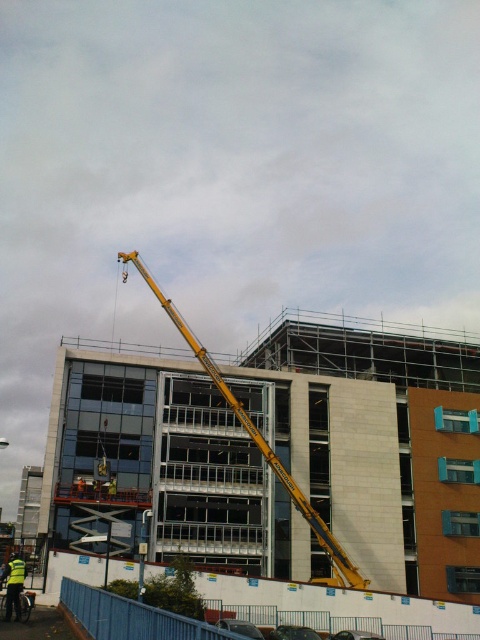
You are a safety inspector at the construction site. You need to ensure that the yellow reflective vest at lower left is visible from the top of the yellow metallic crane at center. Given their height difference, is this possible?

The yellow metallic crane at center is much taller than the yellow reflective vest at lower left, so the vest may not be visible from the top of the crane due to the significant height difference.

You are a safety inspector at the construction site. You notice the yellow metallic crane at center and the yellow reflective vest at lower left. Based on their positions, which object is higher from the ground?

The yellow metallic crane at center is above the yellow reflective vest at lower left, so the crane is higher from the ground.

You are a safety inspector at the construction site and need to ensure that the yellow metallic crane at center and the yellow reflective vest at lower left are placed in compliance with safety regulations. According to the layout, which object is located to the left of the other?

The yellow metallic crane at center is positioned on the left side of yellow reflective vest at lower left, so the crane is to the left of the vest.